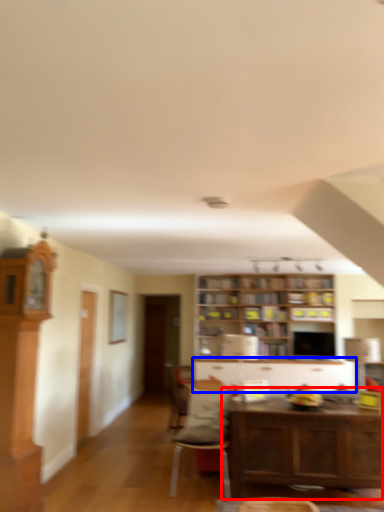
Question: Which point is closer to the camera, table (highlighted by a red box) or cabinetry (highlighted by a blue box)?

Choices:
 (A) table
 (B) cabinetry

Answer: (A)